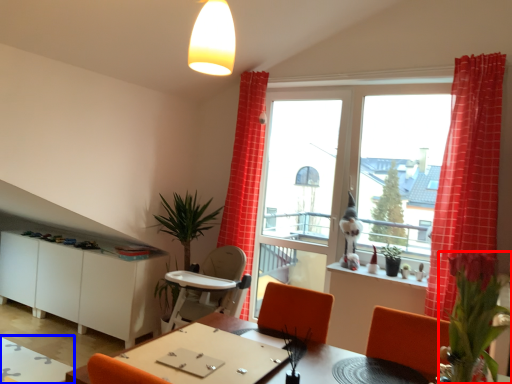
Question: Which object appears closest to the camera in this image, plant (highlighted by a red box) or table (highlighted by a blue box)?

Choices:
 (A) plant
 (B) table

Answer: (A)